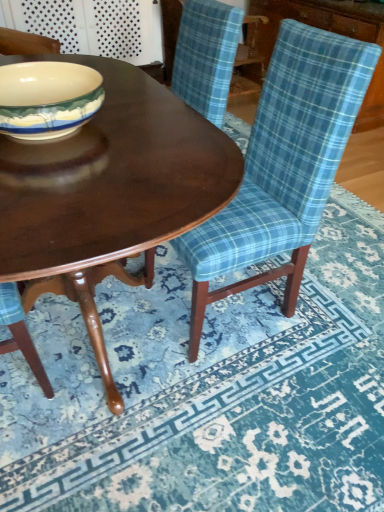
Question: From a real-world perspective, is blue plaid fabric at lower right beneath shiny dark wood coffee table at center?

Choices:
 (A) no
 (B) yes

Answer: (B)

Question: From a real-world perspective, is blue plaid fabric at lower right over shiny dark wood coffee table at center?

Choices:
 (A) yes
 (B) no

Answer: (B)

Question: Considering the relative positions of blue plaid fabric at lower right and shiny dark wood coffee table at center in the image provided, is blue plaid fabric at lower right to the left of shiny dark wood coffee table at center from the viewer's perspective?

Choices:
 (A) yes
 (B) no

Answer: (B)

Question: Is there a large distance between blue plaid fabric at lower right and shiny dark wood coffee table at center?

Choices:
 (A) no
 (B) yes

Answer: (A)

Question: Considering the relative sizes of blue plaid fabric at lower right and shiny dark wood coffee table at center in the image provided, is blue plaid fabric at lower right thinner than shiny dark wood coffee table at center?

Choices:
 (A) no
 (B) yes

Answer: (A)

Question: Considering the positions of blue plaid fabric at lower right and shiny dark wood coffee table at center in the image, is blue plaid fabric at lower right wider or thinner than shiny dark wood coffee table at center?

Choices:
 (A) thin
 (B) wide

Answer: (B)

Question: Is point (104, 445) positioned closer to the camera than point (157, 229)?

Choices:
 (A) farther
 (B) closer

Answer: (A)

Question: Which is correct: blue plaid fabric at lower right is inside shiny dark wood coffee table at center, or outside of it?

Choices:
 (A) outside
 (B) inside

Answer: (A)

Question: From a real-world perspective, is blue plaid fabric at lower right positioned above or below shiny dark wood coffee table at center?

Choices:
 (A) above
 (B) below

Answer: (B)

Question: Is blue plaid fabric chair at center bigger or smaller than matte ceramic bowl at center-left?

Choices:
 (A) small
 (B) big

Answer: (B)

Question: In the image, is blue plaid fabric chair at center positioned in front of or behind matte ceramic bowl at center-left?

Choices:
 (A) front
 (B) behind

Answer: (A)

Question: Does point (301, 260) appear closer or farther from the camera than point (51, 71)?

Choices:
 (A) farther
 (B) closer

Answer: (A)

Question: In terms of width, does blue plaid fabric chair at center look wider or thinner when compared to matte ceramic bowl at center-left?

Choices:
 (A) wide
 (B) thin

Answer: (A)

Question: Considering the positions of blue plaid fabric at lower right and matte ceramic bowl at center-left in the image, is blue plaid fabric at lower right wider or thinner than matte ceramic bowl at center-left?

Choices:
 (A) thin
 (B) wide

Answer: (B)

Question: Visually, is blue plaid fabric at lower right positioned to the left or to the right of matte ceramic bowl at center-left?

Choices:
 (A) right
 (B) left

Answer: (A)